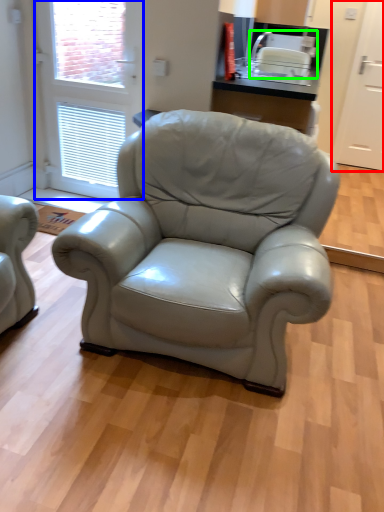
Question: Which object is positioned closest to screen door (highlighted by a red box)? Select from screen door (highlighted by a blue box) and appliance (highlighted by a green box).

Choices:
 (A) screen door
 (B) appliance

Answer: (B)